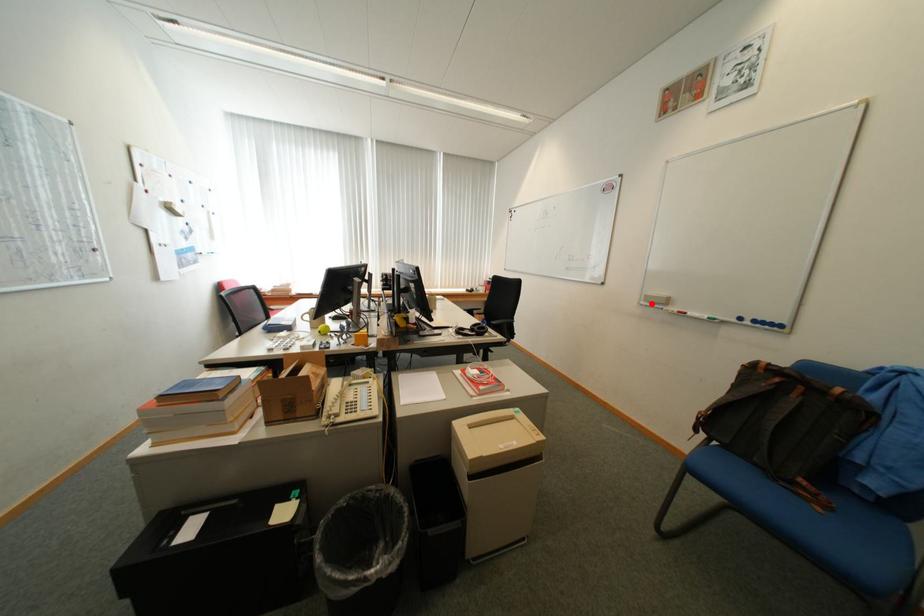
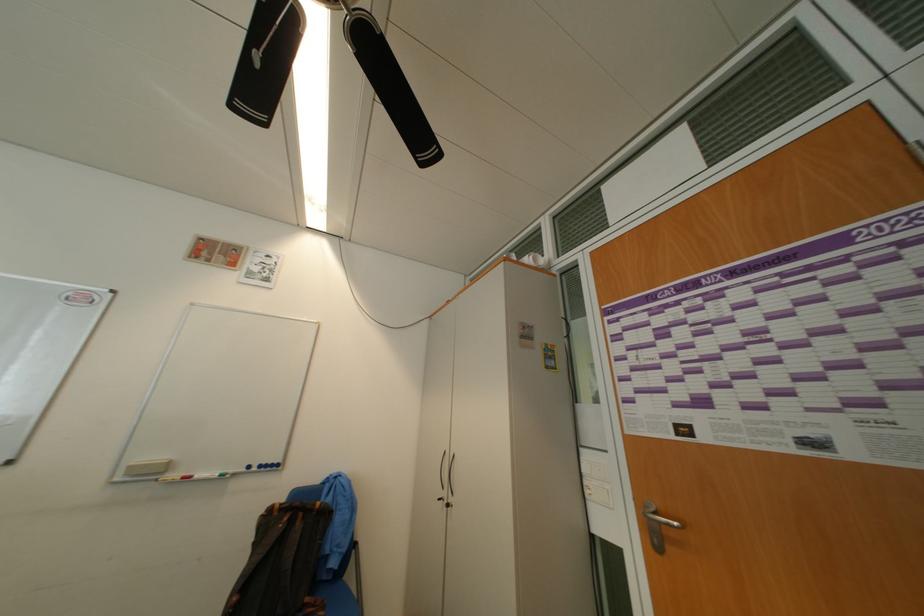
Question: I am providing you with two images of the same scene from different viewpoints. A red point is marked on the first image. At the location where the point appears in image 1, is it still visible in image 2?

Choices:
 (A) Yes
 (B) No

Answer: (A)